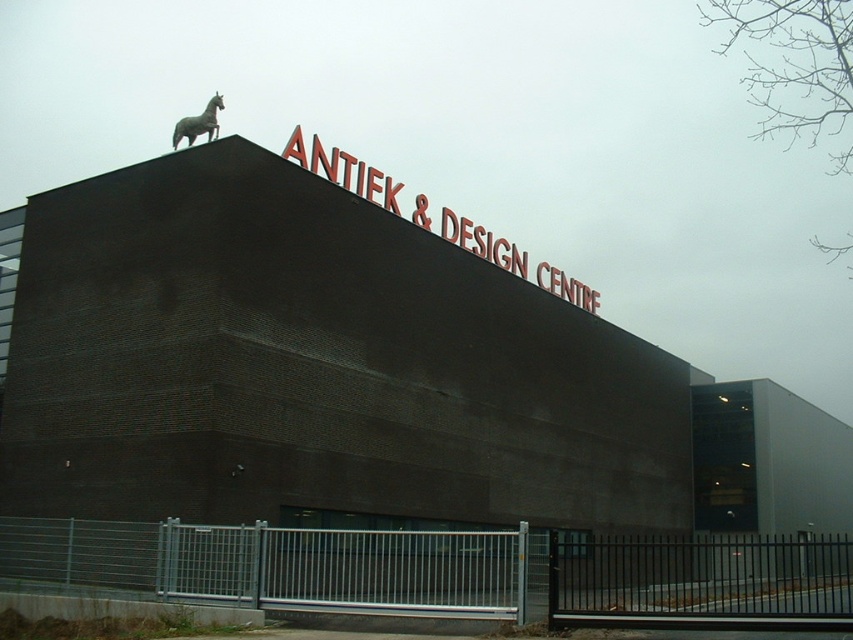
You are a delivery person trying to see the metallic horse at upper center from the street. Is the metallic silver fence at lower center blocking your view of the horse?

The metallic silver fence at lower center is taller than the metallic horse at upper center, so it might block your view of the horse if you are standing at street level.

You are standing in front of the building and want to see the red metallic sign at upper center clearly. Is the metallic silver fence at lower center blocking your view of the sign?

The metallic silver fence at lower center is in front of the red metallic sign at upper center, so it is blocking your view of the sign.